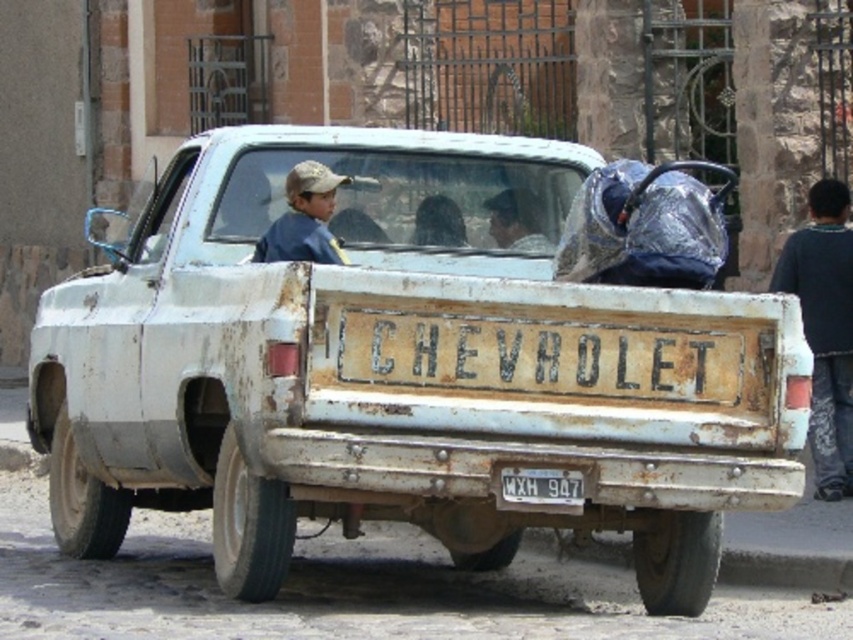
You are a delivery driver who needs to attach a GPS tracker to the license plate of the rusty white truck at center. The GPS tracker must be placed exactly 4 feet away from the truck. Is the white matte license plate at center a suitable location for the GPS tracker?

The distance between the rusty white truck at center and the white matte license plate at center is 3.77 feet, which is less than 4 feet. Therefore, the white matte license plate at center is not a suitable location for the GPS tracker since it is too close to the truck.

You are a delivery person who needs to unload the dark blue fabric at right from the rusty white truck at center. Can you tell me which object is larger so I know if there will be enough space on the ground to lay it out?

The rusty white truck at center is bigger than the dark blue fabric at right, so there should be enough space on the ground to lay out the dark blue fabric at right.

Looking at this image, you are standing at the origin point of a coordinate system where the bottom left corner of the image is the origin. The rusty white truck at center is located at coordinates approximately where?

The rusty white truck at center is located at coordinates approximately 0.578 on the x axis and 0.472 on the y axis.